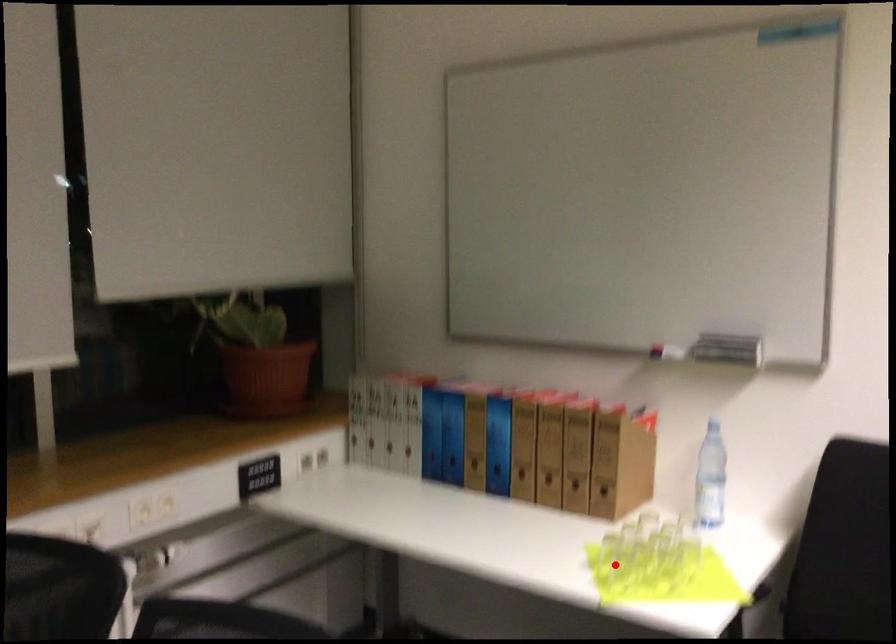
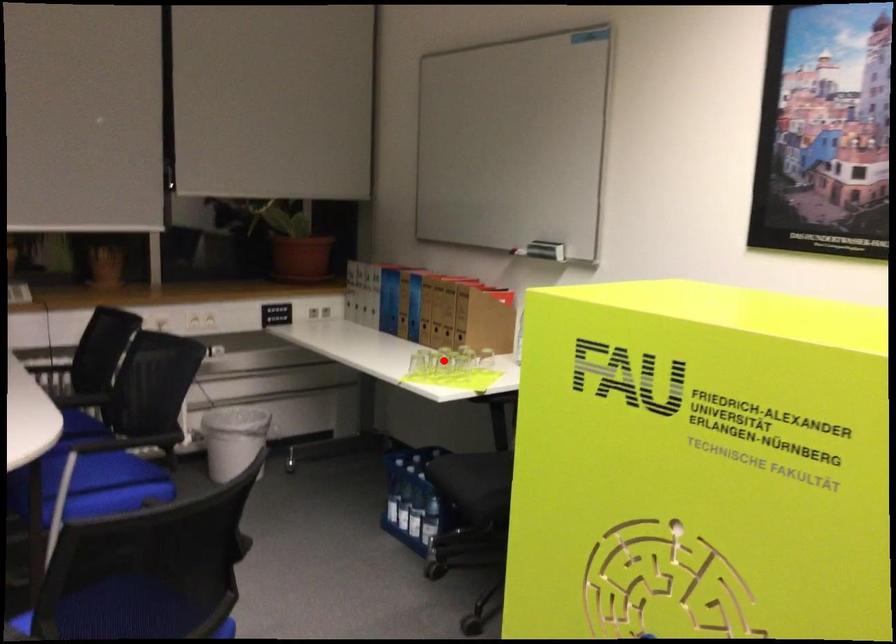
I am providing you with two images of the same scene from different viewpoints. A red point is marked on the first image and another point is marked on the second image. Are the points marked in image1 and image2 representing the same 3D position?

No